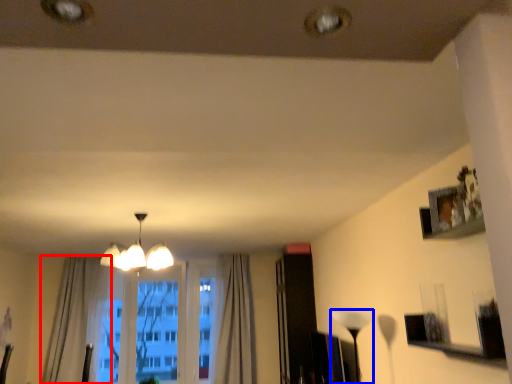
Question: Which point is closer to the camera, curtain (highlighted by a red box) or lamp (highlighted by a blue box)?

Choices:
 (A) curtain
 (B) lamp

Answer: (B)